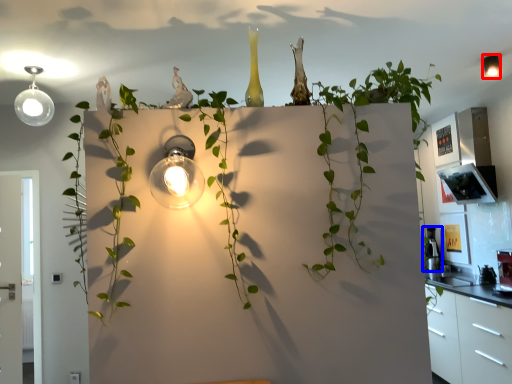
Question: Among these objects, which one is nearest to the camera, light fixture (highlighted by a red box) or appliance (highlighted by a blue box)?

Choices:
 (A) light fixture
 (B) appliance

Answer: (A)